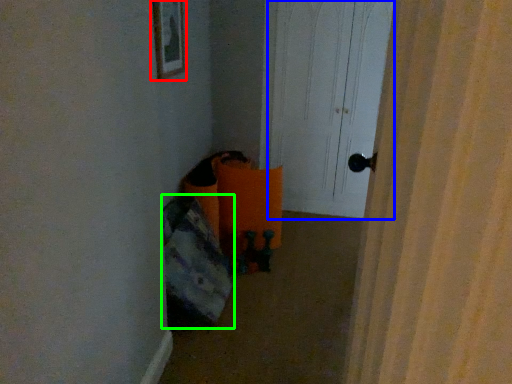
Question: Considering the real-world distances, which object is closest to picture frame (highlighted by a red box)? screen door (highlighted by a blue box) or bean bag chair (highlighted by a green box).

Choices:
 (A) screen door
 (B) bean bag chair

Answer: (B)